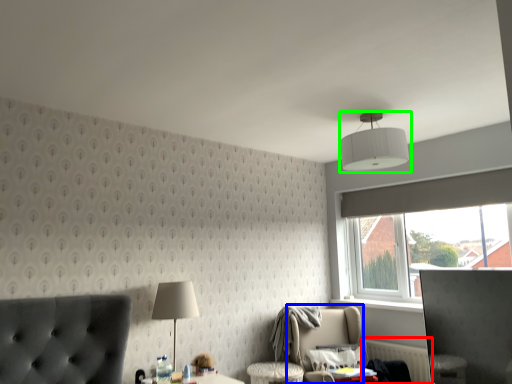
Question: Based on their relative distances, which object is nearer to radiator (highlighted by a red box)? Choose from swivel chair (highlighted by a blue box) and lamp (highlighted by a green box).

Choices:
 (A) swivel chair
 (B) lamp

Answer: (A)